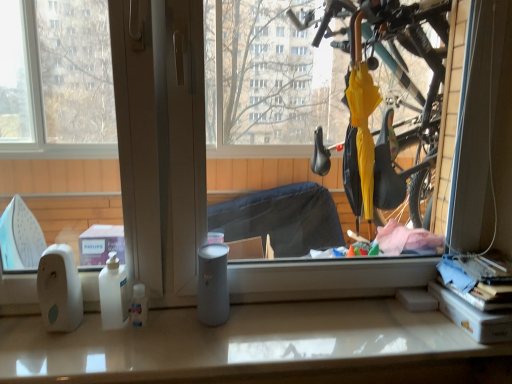
Describe the element at coordinates (324, 278) in the screenshot. This screenshot has height=384, width=512. I see `transparent plastic umbrella at center` at that location.

In order to face transparent plastic umbrella at center, should I rotate leftwards or rightwards?

Turn right by 1.147 degrees to look at transparent plastic umbrella at center.

Locate an element on the screen. The height and width of the screenshot is (384, 512). transparent plastic umbrella at center is located at coordinates (324, 278).

Measure the distance between point (x=95, y=377) and camera.

A distance of 36.06 inches exists between point (x=95, y=377) and camera.

Where is `white glossy counter top at lower center`? The height and width of the screenshot is (384, 512). white glossy counter top at lower center is located at coordinates (258, 347).

Describe the element at coordinates (258, 347) in the screenshot. I see `white glossy counter top at lower center` at that location.

This screenshot has height=384, width=512. In order to click on transparent plastic umbrella at center in this screenshot , I will do `click(324, 278)`.

Does transparent plastic umbrella at center appear on the left side of white glossy counter top at lower center?

Incorrect, transparent plastic umbrella at center is not on the left side of white glossy counter top at lower center.

Is the depth of transparent plastic umbrella at center greater than that of white glossy counter top at lower center?

No.

Is point (296, 277) in front of point (324, 357)?

No.

From the image's perspective, between transparent plastic umbrella at center and white glossy counter top at lower center, which one is located above?

transparent plastic umbrella at center appears higher in the image.

From a real-world perspective, is transparent plastic umbrella at center located higher than white glossy counter top at lower center?

Yes, from a real-world perspective, transparent plastic umbrella at center is above white glossy counter top at lower center.

Does transparent plastic umbrella at center have a greater width compared to white glossy counter top at lower center?

Incorrect, the width of transparent plastic umbrella at center does not surpass that of white glossy counter top at lower center.

Does transparent plastic umbrella at center have a greater height compared to white glossy counter top at lower center?

Yes.

Can you confirm if transparent plastic umbrella at center is bigger than white glossy counter top at lower center?

Indeed, transparent plastic umbrella at center has a larger size compared to white glossy counter top at lower center.

Is white glossy counter top at lower center surrounded by transparent plastic umbrella at center?

No.

Is transparent plastic umbrella at center next to white glossy counter top at lower center?

There is a gap between transparent plastic umbrella at center and white glossy counter top at lower center.

Is transparent plastic umbrella at center facing away from white glossy counter top at lower center?

No.

How different are the orientations of transparent plastic umbrella at center and white glossy counter top at lower center in degrees?

0.0127 degrees separate the facing orientations of transparent plastic umbrella at center and white glossy counter top at lower center.

This screenshot has width=512, height=384. Find the location of `counter top on the left of the transparent plastic umbrella at center`. counter top on the left of the transparent plastic umbrella at center is located at coordinates (258, 347).

Considering the relative positions of white glossy counter top at lower center and transparent plastic umbrella at center in the image provided, is white glossy counter top at lower center to the left of transparent plastic umbrella at center from the viewer's perspective?

Correct, you'll find white glossy counter top at lower center to the left of transparent plastic umbrella at center.

Is white glossy counter top at lower center in front of or behind transparent plastic umbrella at center in the image?

Visually, white glossy counter top at lower center is located behind transparent plastic umbrella at center.

Which is nearer, (121,342) or (272,167)?

Clearly, point (121,342) is closer to the camera than point (272,167).

From the image's perspective, which is above, white glossy counter top at lower center or transparent plastic umbrella at center?

transparent plastic umbrella at center, from the image's perspective.

From a real-world perspective, is white glossy counter top at lower center below transparent plastic umbrella at center?

Yes, from a real-world perspective, white glossy counter top at lower center is below transparent plastic umbrella at center.

In the scene shown: Considering the sizes of white glossy counter top at lower center and transparent plastic umbrella at center in the image, is white glossy counter top at lower center wider or thinner than transparent plastic umbrella at center?

In the image, white glossy counter top at lower center appears to be wider than transparent plastic umbrella at center.

Considering the sizes of white glossy counter top at lower center and transparent plastic umbrella at center in the image, is white glossy counter top at lower center taller or shorter than transparent plastic umbrella at center?

In the image, white glossy counter top at lower center appears to be shorter than transparent plastic umbrella at center.

In terms of size, does white glossy counter top at lower center appear bigger or smaller than transparent plastic umbrella at center?

In the image, white glossy counter top at lower center appears to be smaller than transparent plastic umbrella at center.

Does white glossy counter top at lower center contain transparent plastic umbrella at center?

No, transparent plastic umbrella at center is not inside white glossy counter top at lower center.

Is white glossy counter top at lower center positioned far away from transparent plastic umbrella at center?

Yes, white glossy counter top at lower center is far from transparent plastic umbrella at center.

Is white glossy counter top at lower center oriented away from transparent plastic umbrella at center?

No, white glossy counter top at lower center is not facing the opposite direction of transparent plastic umbrella at center.

How far apart are white glossy counter top at lower center and transparent plastic umbrella at center?

white glossy counter top at lower center is 1.38 meters from transparent plastic umbrella at center.

Find the location of a particular element. This screenshot has height=384, width=512. counter top on the left side of transparent plastic umbrella at center is located at coordinates (258, 347).

This screenshot has width=512, height=384. In order to click on counter top that is under the transparent plastic umbrella at center (from a real-world perspective) in this screenshot , I will do click(x=258, y=347).

You are a GUI agent. You are given a task and a screenshot of the screen. Output one action in this format:
    pyautogui.click(x=<x>, y=<y>)
    Task: Click on the counter top lying below the transparent plastic umbrella at center (from the image's perspective)
    The width and height of the screenshot is (512, 384).
    Given the screenshot: What is the action you would take?
    pyautogui.click(x=258, y=347)